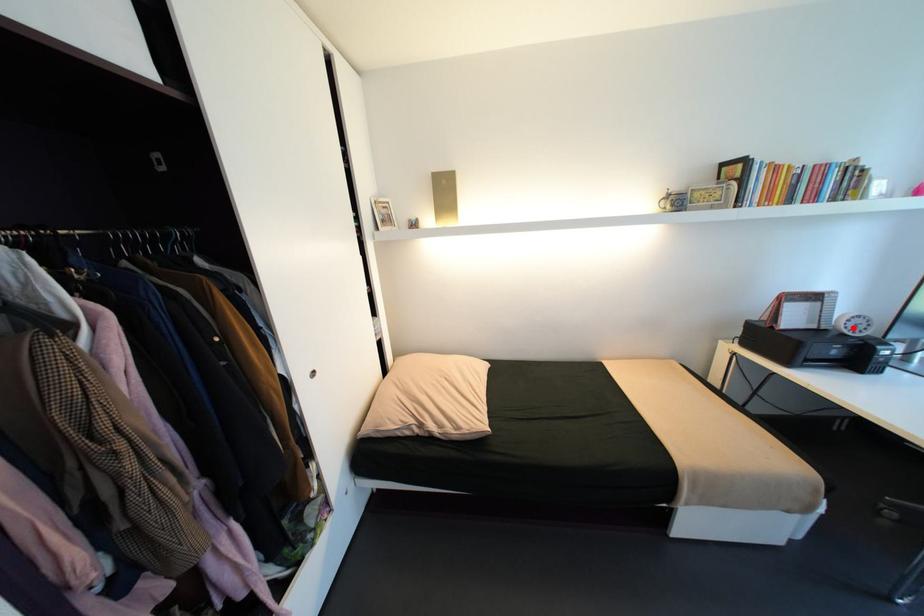
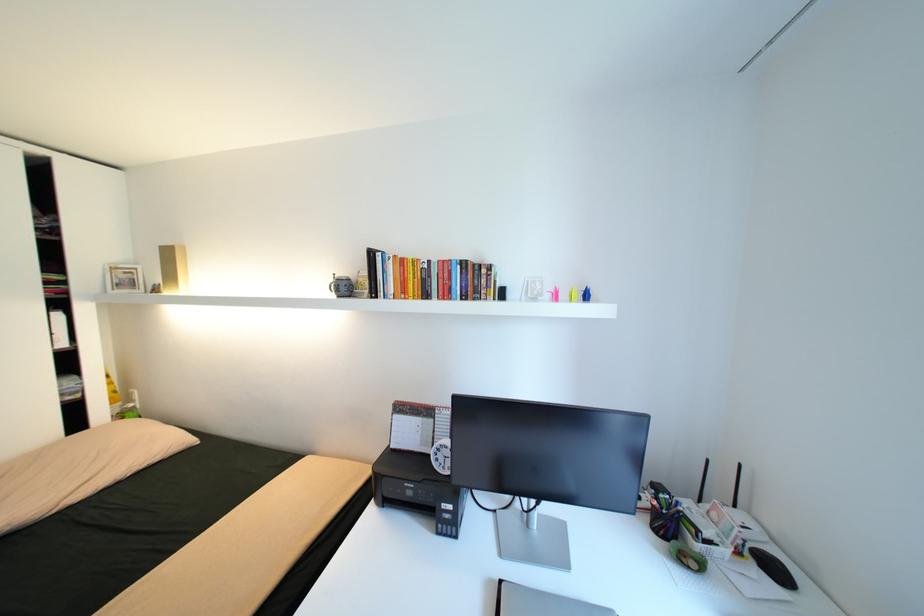
The point at the highlighted location is marked in the first image. Where is the corresponding point in the second image?

(444, 460)